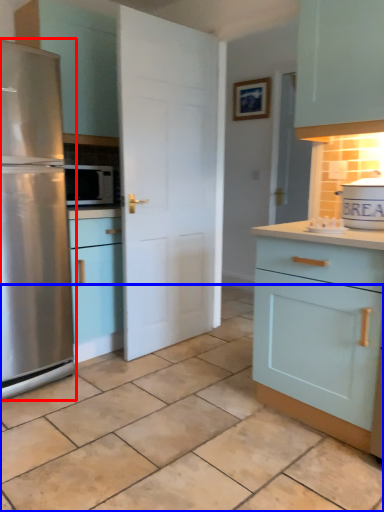
Question: Among these objects, which one is farthest to the camera, refrigerator (highlighted by a red box) or tile (highlighted by a blue box)?

Choices:
 (A) refrigerator
 (B) tile

Answer: (A)